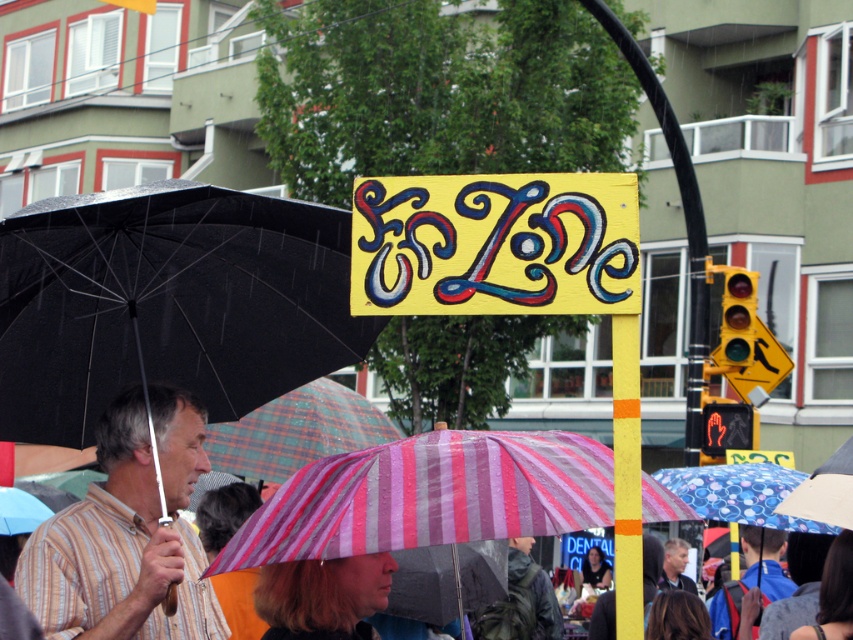
Does point (158, 624) come in front of point (276, 593)?

No, (158, 624) is further to viewer.

Which is more to the right, striped shirt at center or blonde hair at center?

blonde hair at center is more to the right.

Identify the location of striped shirt at center. The image size is (853, 640). (126, 532).

Is point (666, 502) farther from camera compared to point (26, 580)?

No, (666, 502) is in front of (26, 580).

Who is shorter, pink striped fabric umbrella at center or striped shirt at center?

Standing shorter between the two is pink striped fabric umbrella at center.

Is point (664, 508) closer to viewer compared to point (187, 497)?

Yes.

The height and width of the screenshot is (640, 853). Identify the location of pink striped fabric umbrella at center. pyautogui.click(x=432, y=496).

Looking at this image, does black matte umbrella at upper left have a greater width compared to blonde hair at center?

Yes, black matte umbrella at upper left is wider than blonde hair at center.

Who is higher up, black matte umbrella at upper left or blonde hair at center?

black matte umbrella at upper left is above.

Is point (288, 278) farther from viewer compared to point (276, 605)?

Yes, it is behind point (276, 605).

Find the location of `black matte umbrella at upper left`. black matte umbrella at upper left is located at coordinates (167, 301).